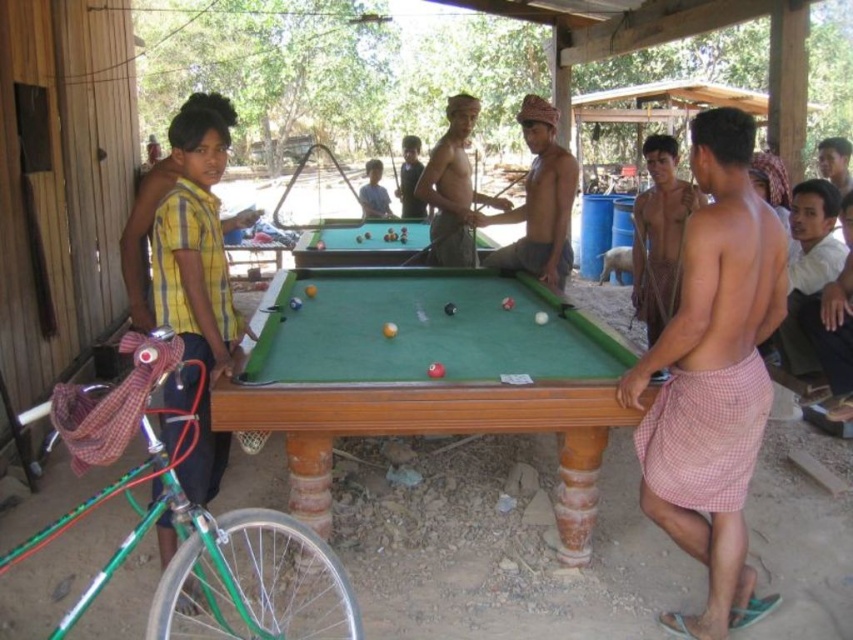
Question: Does pink checkered cloth at right have a greater width compared to shiny brown skin at center?

Choices:
 (A) no
 (B) yes

Answer: (B)

Question: Does pink checkered cloth at right appear on the left side of yellow striped shirt at left?

Choices:
 (A) no
 (B) yes

Answer: (A)

Question: Which point is closer to the camera?

Choices:
 (A) (653, 339)
 (B) (416, 262)
 (C) (834, 182)
 (D) (735, 346)

Answer: (D)

Question: In this image, where is green felt pool table at center located relative to smooth skin face at upper right?

Choices:
 (A) above
 (B) below

Answer: (B)

Question: Which object appears farthest from the camera in this image?

Choices:
 (A) smooth skin boy at center
 (B) shiny brown skin at center
 (C) brown woven hat at center

Answer: (A)

Question: Which point appears farthest from the camera in this image?

Choices:
 (A) (381, 396)
 (B) (543, 275)

Answer: (B)